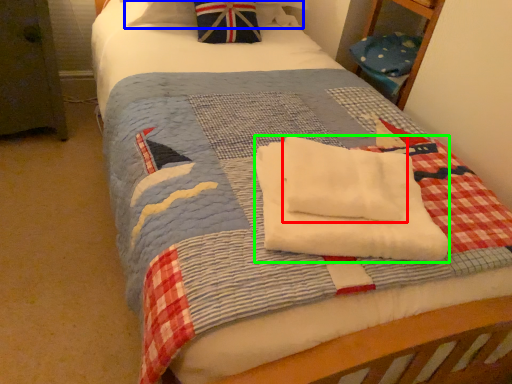
Question: Based on their relative distances, which object is nearer to beach towel (highlighted by a red box)? Choose from pillow (highlighted by a blue box) and beach towel (highlighted by a green box).

Choices:
 (A) pillow
 (B) beach towel

Answer: (B)